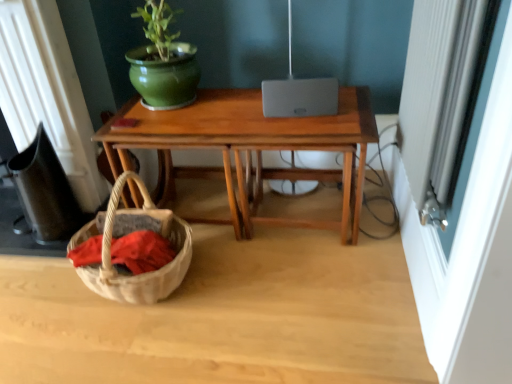
Question: Is wooden desk at center positioned in front of white textured screen door at right?

Choices:
 (A) yes
 (B) no

Answer: (B)

Question: From a real-world perspective, does wooden desk at center sit lower than white textured screen door at right?

Choices:
 (A) no
 (B) yes

Answer: (B)

Question: Is wooden desk at center outside white textured screen door at right?

Choices:
 (A) no
 (B) yes

Answer: (B)

Question: From the image's perspective, is wooden desk at center beneath white textured screen door at right?

Choices:
 (A) no
 (B) yes

Answer: (B)

Question: Is wooden desk at center aimed at white textured screen door at right?

Choices:
 (A) no
 (B) yes

Answer: (A)

Question: Considering the relative sizes of wooden desk at center and white textured screen door at right in the image provided, is wooden desk at center thinner than white textured screen door at right?

Choices:
 (A) yes
 (B) no

Answer: (B)

Question: From the image's perspective, is satin silver lamp at center on white textured screen door at right?

Choices:
 (A) no
 (B) yes

Answer: (B)

Question: Can you confirm if satin silver lamp at center is wider than white textured screen door at right?

Choices:
 (A) no
 (B) yes

Answer: (B)

Question: Considering the relative sizes of satin silver lamp at center and white textured screen door at right in the image provided, is satin silver lamp at center shorter than white textured screen door at right?

Choices:
 (A) no
 (B) yes

Answer: (A)

Question: Is the position of satin silver lamp at center less distant than that of white textured screen door at right?

Choices:
 (A) yes
 (B) no

Answer: (B)

Question: Is satin silver lamp at center to the left of white textured screen door at right from the viewer's perspective?

Choices:
 (A) yes
 (B) no

Answer: (A)

Question: From a real-world perspective, is satin silver lamp at center over white textured screen door at right?

Choices:
 (A) no
 (B) yes

Answer: (A)

Question: Considering the relative sizes of satin silver lamp at center and wooden desk at center in the image provided, is satin silver lamp at center shorter than wooden desk at center?

Choices:
 (A) yes
 (B) no

Answer: (B)